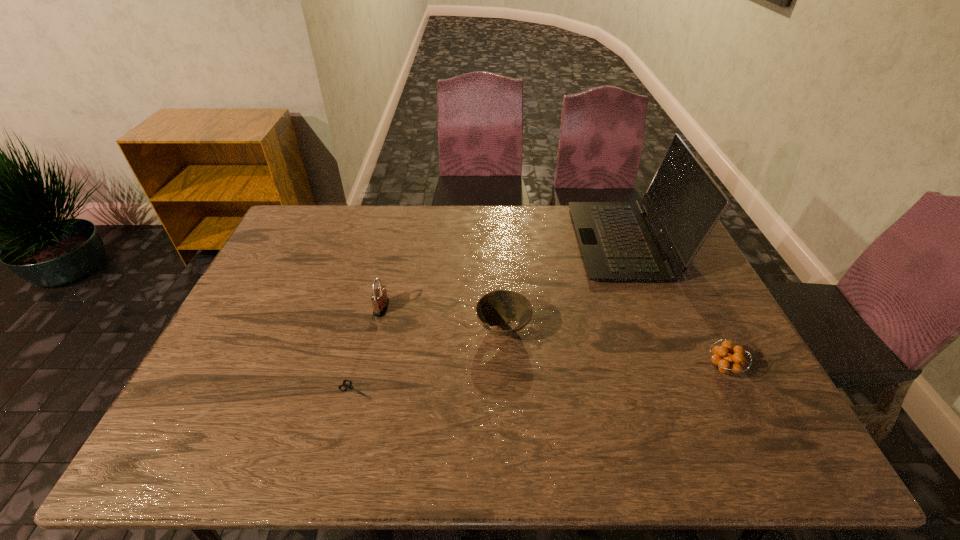
Find the location of a particular element. free area in between the second tallest object and the shears is located at coordinates (369, 349).

Choose which object is the third nearest neighbor to the padlock. Please provide its 2D coordinates. Your answer should be formatted as a tuple, i.e. [(x, y)], where the tuple contains the x and y coordinates of a point satisfying the conditions above.

[(618, 243)]

Choose which object is the third nearest neighbor to the laptop computer. Please provide its 2D coordinates. Your answer should be formatted as a tuple, i.e. [(x, y)], where the tuple contains the x and y coordinates of a point satisfying the conditions above.

[(380, 301)]

At what (x,y) coordinates should I click in order to perform the action: click on free space that satisfies the following two spatial constraints: 1. on the front side of the bowl; 2. on the right side of the padlock. Please return your answer as a coordinate pair (x, y). This screenshot has height=540, width=960. Looking at the image, I should click on 377,328.

Identify the location of blank space that satisfies the following two spatial constraints: 1. on the screen of the farthest object; 2. on the front side of the bowl. The height and width of the screenshot is (540, 960). (660, 328).

Identify the location of vacant space that satisfies the following two spatial constraints: 1. on the front side of the third object from right to left; 2. on the right side of the orange fruit. This screenshot has height=540, width=960. (505, 368).

The width and height of the screenshot is (960, 540). I want to click on vacant space that satisfies the following two spatial constraints: 1. on the front side of the padlock; 2. on the left side of the orange fruit, so click(368, 368).

This screenshot has width=960, height=540. I want to click on vacant position in the image that satisfies the following two spatial constraints: 1. on the screen of the farthest object; 2. on the front side of the padlock, so click(x=652, y=308).

The width and height of the screenshot is (960, 540). In order to click on vacant region that satisfies the following two spatial constraints: 1. on the back side of the orange fruit; 2. on the screen of the farthest object in this screenshot , I will do `click(660, 241)`.

The width and height of the screenshot is (960, 540). Identify the location of free point that satisfies the following two spatial constraints: 1. on the front side of the fourth shortest object; 2. on the right side of the bowl. (377, 328).